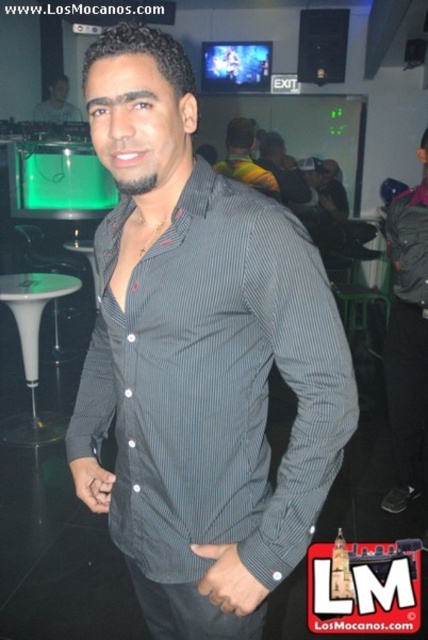
Question: Which object is closer to the camera taking this photo?

Choices:
 (A) dark gray striped shirt at center
 (B) striped shirt at center
 (C) white plastic bar stool at lower left
 (D) green plastic bar stool at center

Answer: (A)

Question: Estimate the real-world distances between objects in this image. Which object is closer to the white plastic bar stool at lower left?

Choices:
 (A) striped shirt at center
 (B) dark gray striped shirt at center
 (C) striped cotton shirt at center

Answer: (A)

Question: Can you confirm if dark gray striped shirt at center is wider than striped shirt at center?

Choices:
 (A) yes
 (B) no

Answer: (B)

Question: Can you confirm if white plastic bar stool at lower left is positioned below matte black shirt at center?

Choices:
 (A) no
 (B) yes

Answer: (B)

Question: Does striped cotton shirt at center have a greater width compared to green plastic bar stool at center?

Choices:
 (A) no
 (B) yes

Answer: (A)

Question: Among these points, which one is farthest from the camera?

Choices:
 (A) (232, 145)
 (B) (14, 300)

Answer: (A)